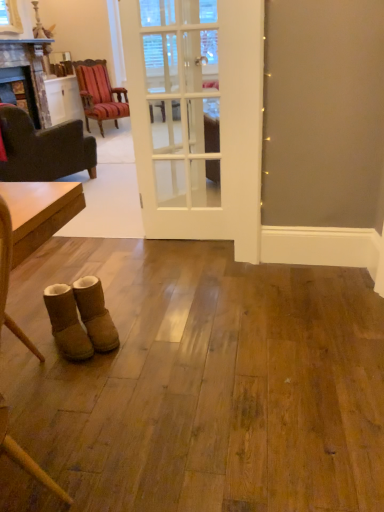
Question: From the image's perspective, would you say striped fabric chair at upper left, the 2th chair from the bottom, is shown under white glass door at center?

Choices:
 (A) yes
 (B) no

Answer: (B)

Question: Does striped fabric chair at upper left, positioned as the 1th chair in back-to-front order, have a lesser height compared to white glass door at center?

Choices:
 (A) yes
 (B) no

Answer: (A)

Question: Is striped fabric chair at upper left, marked as the first chair in a top-to-bottom arrangement, aimed at white glass door at center?

Choices:
 (A) no
 (B) yes

Answer: (B)

Question: Is striped fabric chair at upper left, the 2th chair from the bottom, smaller than white glass door at center?

Choices:
 (A) yes
 (B) no

Answer: (B)

Question: Could white glass door at center be considered to be inside striped fabric chair at upper left, marked as the first chair in a top-to-bottom arrangement?

Choices:
 (A) yes
 (B) no

Answer: (B)

Question: From a real-world perspective, is striped fabric chair at upper left, the 2th chair from the bottom, on top of white glass door at center?

Choices:
 (A) yes
 (B) no

Answer: (B)

Question: From the image's perspective, is dark brown fabric armchair at left, the first chair ordered from the bottom, above suede boots at lower left, acting as the second footwear starting from the right?

Choices:
 (A) yes
 (B) no

Answer: (A)

Question: From a real-world perspective, is dark brown fabric armchair at left, the 1th chair in the front-to-back sequence, physically above suede boots at lower left, which ranks as the first footwear in left-to-right order?

Choices:
 (A) no
 (B) yes

Answer: (B)

Question: Is dark brown fabric armchair at left, placed as the second chair when sorted from top to bottom, taller than suede boots at lower left, acting as the second footwear starting from the right?

Choices:
 (A) yes
 (B) no

Answer: (A)

Question: Could you tell me if dark brown fabric armchair at left, placed as the second chair when sorted from top to bottom, is facing suede boots at lower left, which ranks as the first footwear in left-to-right order?

Choices:
 (A) yes
 (B) no

Answer: (B)

Question: Is dark brown fabric armchair at left, the 1th chair in the front-to-back sequence, at the left side of suede boots at lower left, acting as the second footwear starting from the right?

Choices:
 (A) no
 (B) yes

Answer: (B)

Question: Is dark brown fabric armchair at left, placed as the second chair when sorted from top to bottom, thinner than suede boots at lower left, which ranks as the first footwear in left-to-right order?

Choices:
 (A) yes
 (B) no

Answer: (B)

Question: Is dark brown fabric armchair at left, which appears as the second chair when viewed from the back, at the back of wooden polished table at left?

Choices:
 (A) no
 (B) yes

Answer: (A)